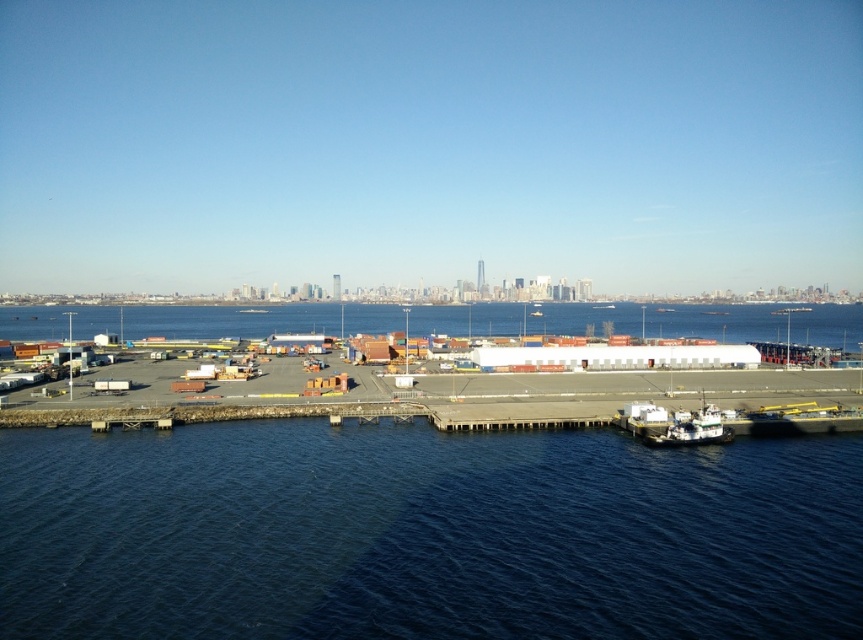
Question: Which point is closer to the camera?

Choices:
 (A) (x=502, y=465)
 (B) (x=712, y=406)

Answer: (A)

Question: Can you confirm if dark blue water at lower center is positioned to the right of white matte boat at lower right?

Choices:
 (A) yes
 (B) no

Answer: (B)

Question: Which object appears closest to the camera in this image?

Choices:
 (A) white matte boat at lower right
 (B) dark blue water at lower center

Answer: (B)

Question: Can you confirm if dark blue water at lower center is bigger than white matte boat at lower right?

Choices:
 (A) yes
 (B) no

Answer: (A)

Question: From the image, what is the correct spatial relationship of dark blue water at lower center in relation to white matte boat at lower right?

Choices:
 (A) below
 (B) above

Answer: (A)